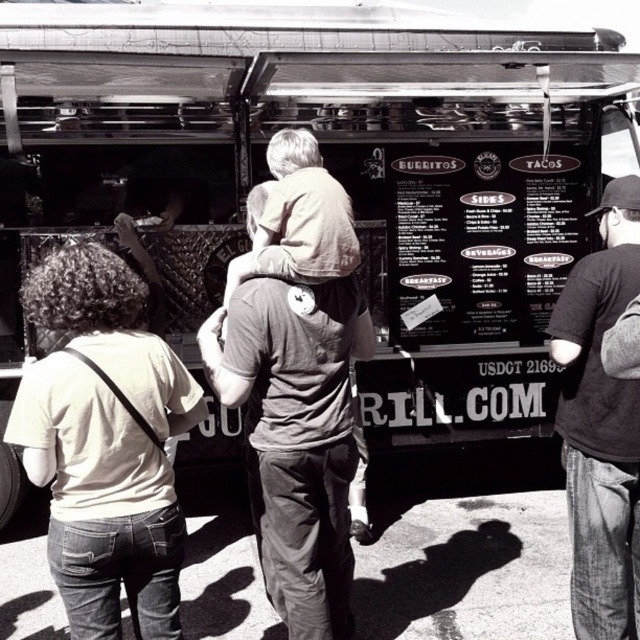
Question: Which point is farther to the camera?

Choices:
 (A) (451, 257)
 (B) (596, 416)

Answer: (A)

Question: Can you confirm if black matte menu board at center is positioned above dark gray t-shirt at right?

Choices:
 (A) no
 (B) yes

Answer: (B)

Question: Is black matte menu board at center smaller than dark gray t-shirt at right?

Choices:
 (A) yes
 (B) no

Answer: (B)

Question: Which point is closer to the camera taking this photo?

Choices:
 (A) (579, 346)
 (B) (458, 225)

Answer: (A)

Question: Does black matte menu board at center appear on the right side of dark gray t-shirt at right?

Choices:
 (A) yes
 (B) no

Answer: (B)